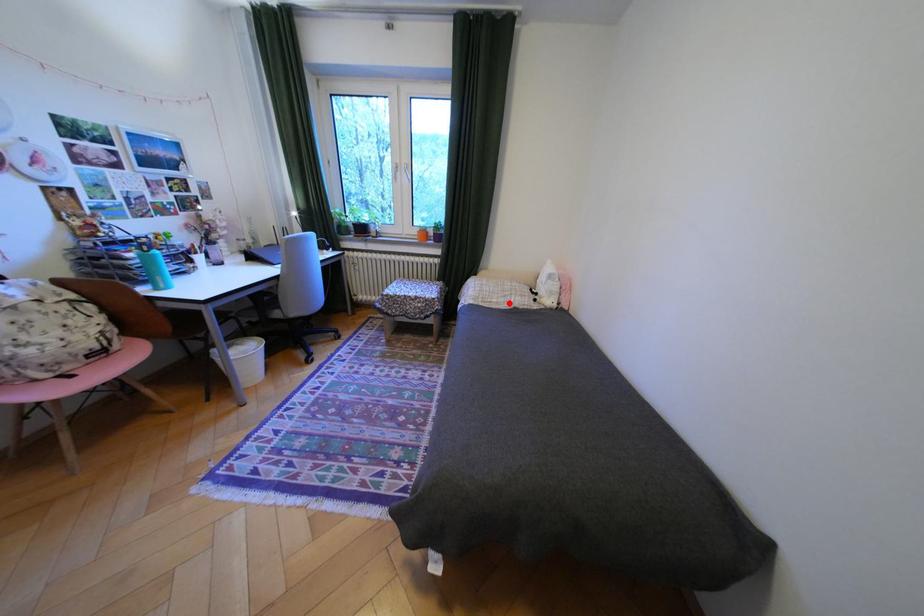
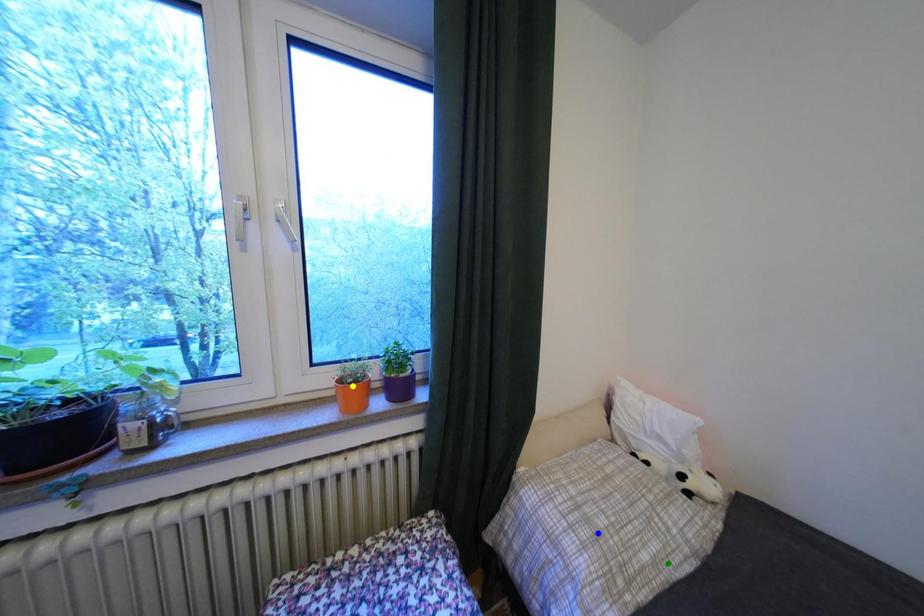
Question: I am providing you with two images of the same scene from different viewpoints. A red point is marked on the first image. You are given multiple points on the second image. Which mark in image 2 goes with the point in image 1?

Choices:
 (A) green point
 (B) blue point
 (C) yellow point

Answer: (A)